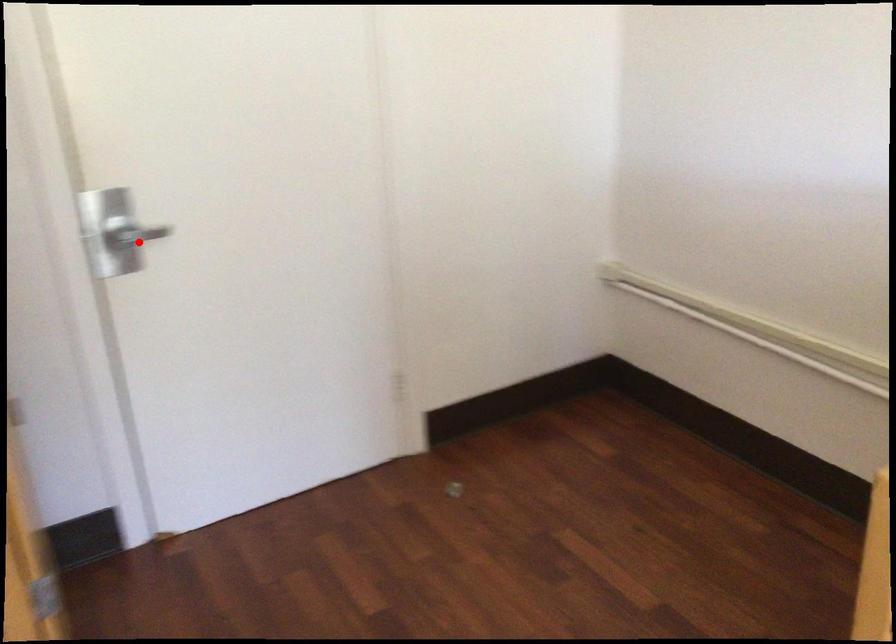
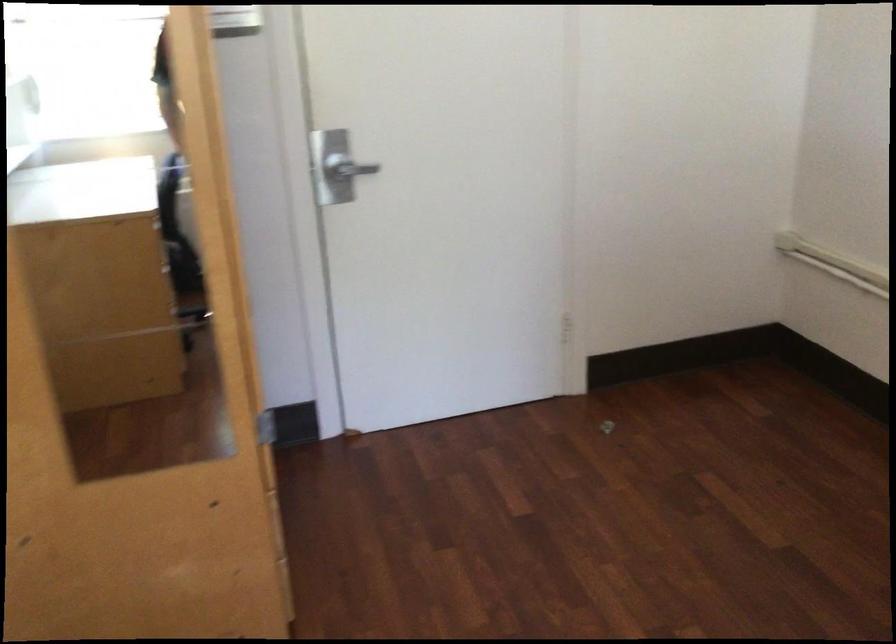
Question: A red point is marked in image1. In image2, is the corresponding 3D point closer to the camera or farther? Reply with the corresponding letter.

Choices:
 (A) The corresponding 3D point is closer.
 (B) The corresponding 3D point is farther.

Answer: (B)